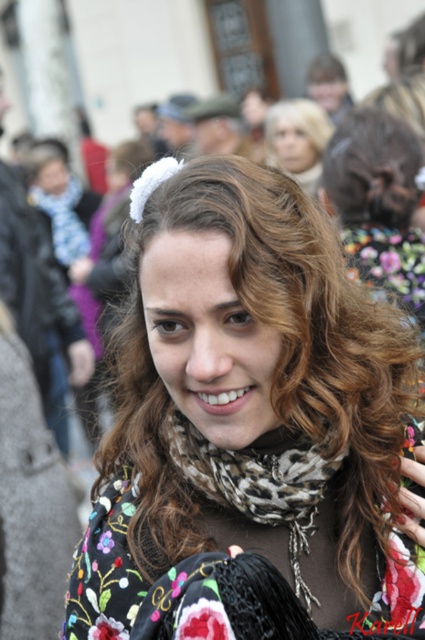
Question: Which object appears farthest from the camera in this image?

Choices:
 (A) leopard print scarf at center
 (B) floral-patterned scarf at center
 (C) floral fabric shawl at center

Answer: (A)

Question: Among these points, which one is nearest to the camera?

Choices:
 (A) (260, 260)
 (B) (248, 513)

Answer: (A)

Question: Which point appears closest to the camera in this image?

Choices:
 (A) (227, 460)
 (B) (354, 624)
 (C) (255, 634)

Answer: (C)

Question: Can you confirm if floral-patterned scarf at center is thinner than leopard print scarf at center?

Choices:
 (A) yes
 (B) no

Answer: (B)

Question: Is floral fabric shawl at center further to camera compared to leopard print scarf at center?

Choices:
 (A) no
 (B) yes

Answer: (A)

Question: Is floral fabric shawl at center smaller than leopard print scarf at center?

Choices:
 (A) no
 (B) yes

Answer: (A)